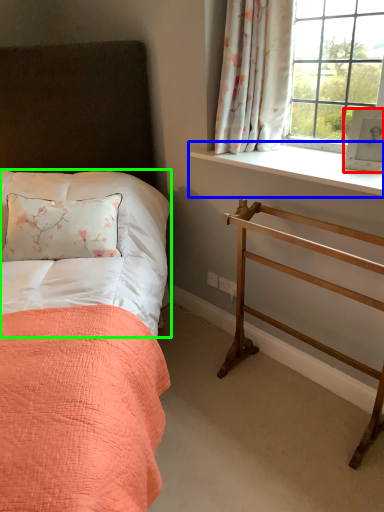
Question: Based on their relative distances, which object is nearer to picture frame (highlighted by a red box)? Choose from window sill (highlighted by a blue box) and sheet (highlighted by a green box).

Choices:
 (A) window sill
 (B) sheet

Answer: (A)